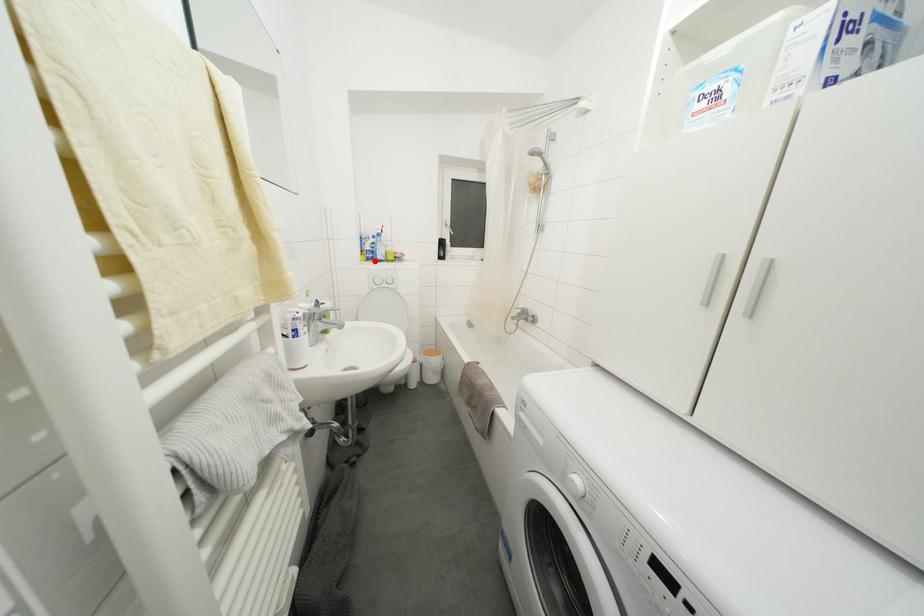
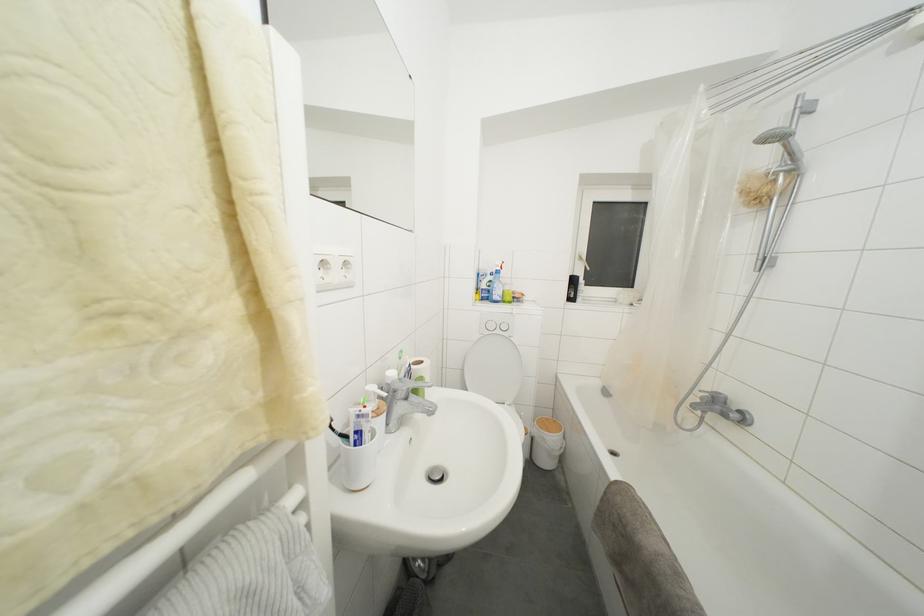
Find the pixel in the second image that matches the highlighted location in the first image.

(490, 301)